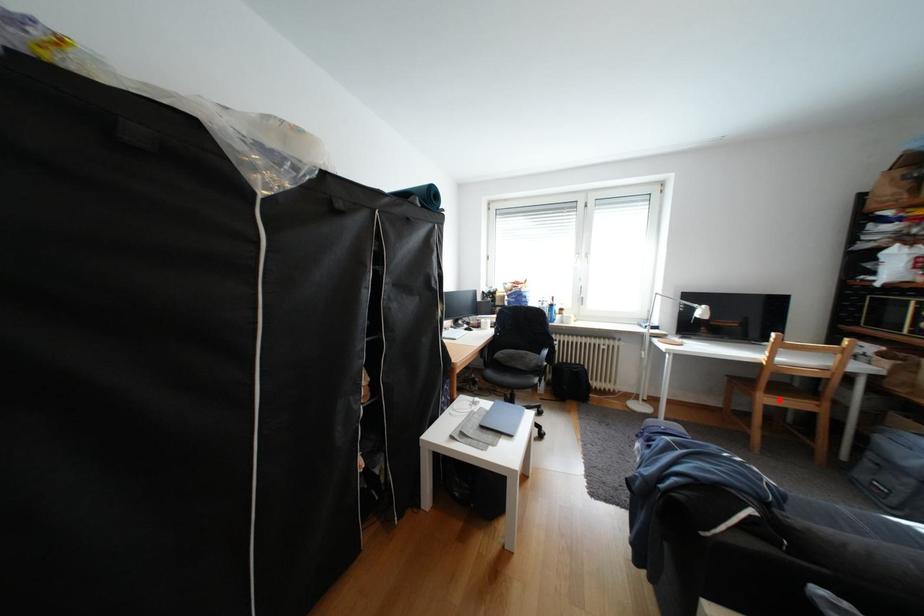
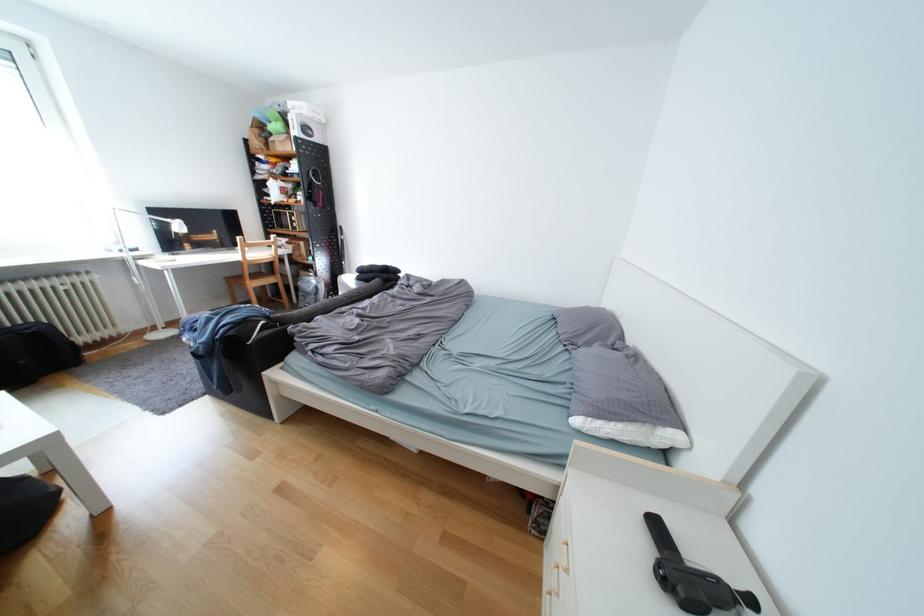
The point at the highlighted location is marked in the first image. Where is the corresponding point in the second image?

(265, 285)